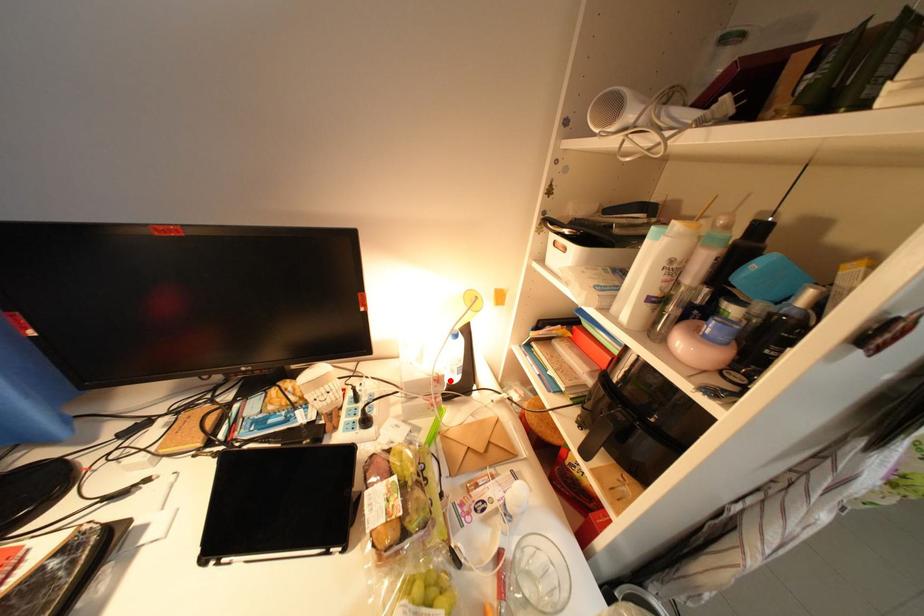
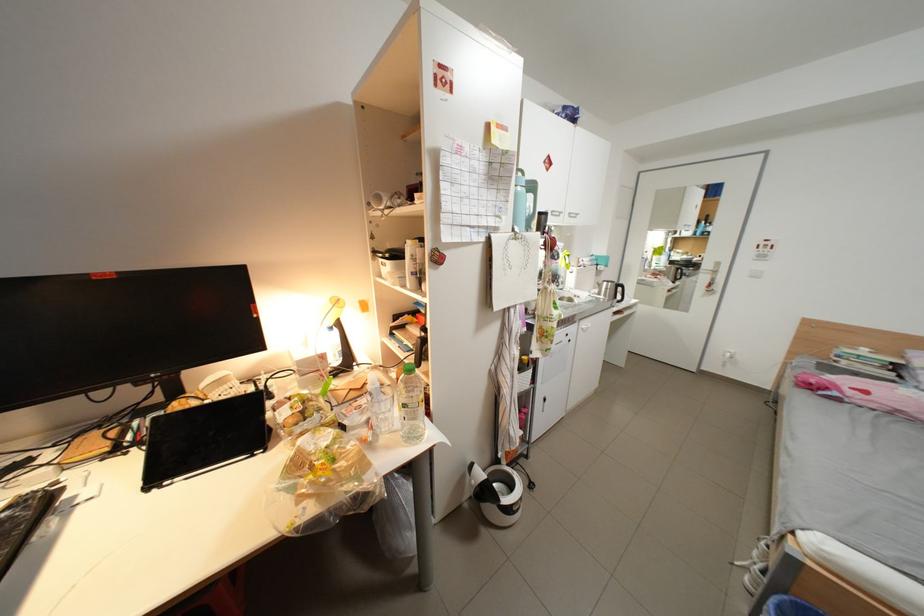
Locate, in the second image, the point that corresponds to the highlighted location in the first image.

(334, 358)